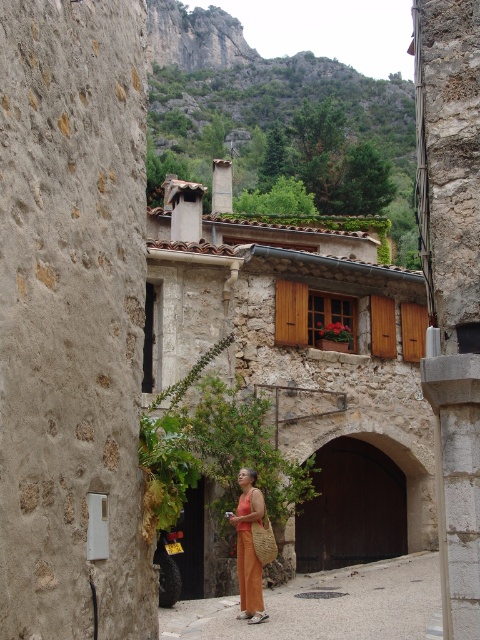
Question: Which of the following is the closest to the observer?

Choices:
 (A) (241, 637)
 (B) (295, 333)
 (C) (251, 493)

Answer: (A)

Question: Observing the image, what is the correct spatial positioning of orange woven bag at center in reference to orange woven dress at center?

Choices:
 (A) left
 (B) right

Answer: (B)

Question: Is orange woven bag at center bigger than orange woven dress at center?

Choices:
 (A) yes
 (B) no

Answer: (B)

Question: Which of the following is the closest to the observer?

Choices:
 (A) orange woven dress at center
 (B) orange woven bag at center

Answer: (A)

Question: Among these points, which one is farthest from the camera?

Choices:
 (A) (252, 342)
 (B) (437, 614)
 (C) (240, 595)
 (D) (252, 611)

Answer: (A)

Question: Does stone textured building at center have a larger size compared to orange woven dress at center?

Choices:
 (A) yes
 (B) no

Answer: (A)